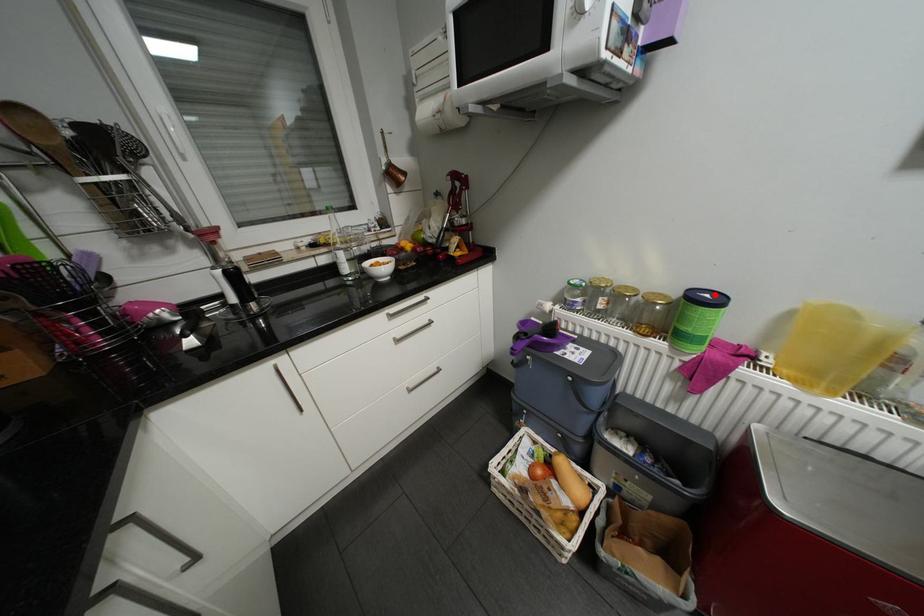
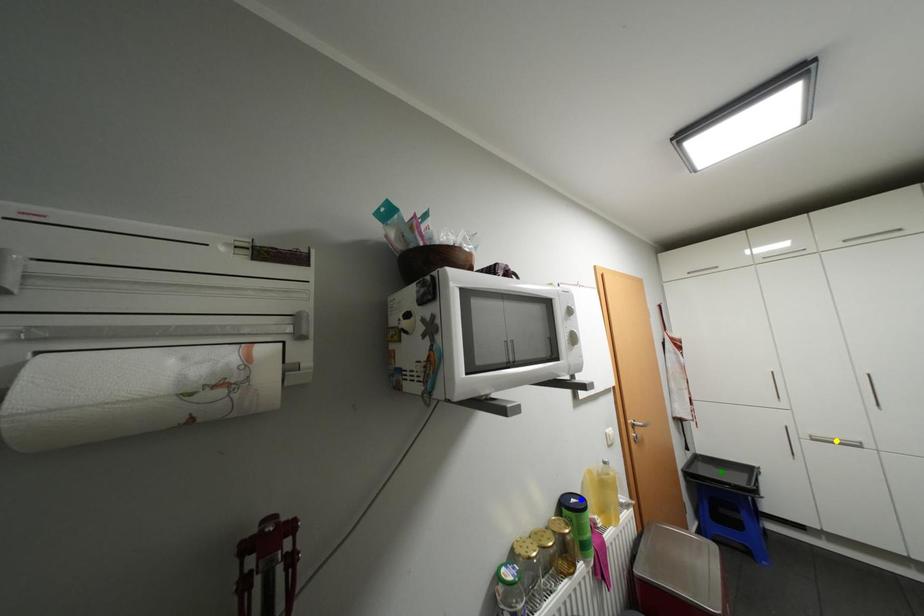
Question: I am providing you with two images of the same scene from different viewpoints. A red point is marked on the first image. You are given multiple points on the second image. Which mark in image 2 goes with the point in image 1?

Choices:
 (A) green point
 (B) yellow point
 (C) blue point

Answer: (C)